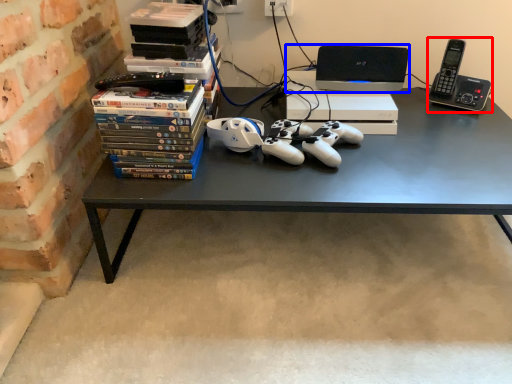
Question: Which of the following is the closest to the observer, gadget (highlighted by a red box) or computer (highlighted by a blue box)?

Choices:
 (A) gadget
 (B) computer

Answer: (A)